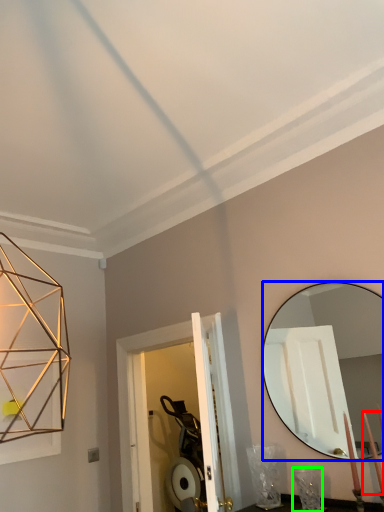
Question: Which is nearer to the candle (highlighted by a red box)? mirror (highlighted by a blue box) or table lamp (highlighted by a green box).

Choices:
 (A) mirror
 (B) table lamp

Answer: (B)